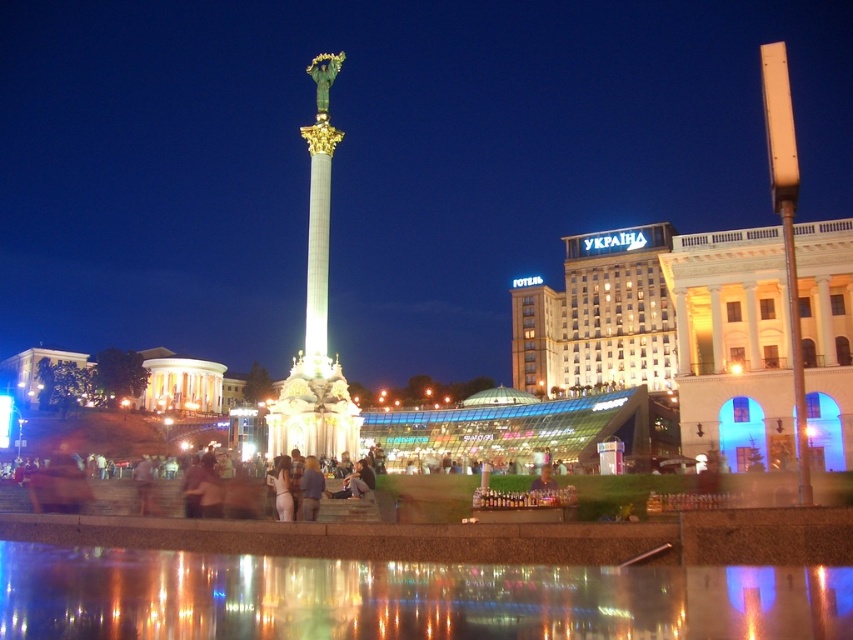
Question: Among these points, which one is nearest to the camera?

Choices:
 (A) (544, 476)
 (B) (318, 212)
 (C) (816, 572)

Answer: (C)

Question: Is transparent glass water at lower center smaller than smooth skin face at center?

Choices:
 (A) yes
 (B) no

Answer: (B)

Question: Can you confirm if shiny gold column at center is thinner than blue denim jeans at center?

Choices:
 (A) yes
 (B) no

Answer: (B)

Question: Is transparent glass water at lower center below blue denim jeans at center?

Choices:
 (A) yes
 (B) no

Answer: (A)

Question: Considering the real-world distances, which object is closest to the shiny gold column at center?

Choices:
 (A) transparent glass water at lower center
 (B) blue denim jeans at center
 (C) smooth skin face at center

Answer: (B)

Question: Which object appears farthest from the camera in this image?

Choices:
 (A) transparent glass water at lower center
 (B) smooth skin face at center
 (C) blue denim jeans at center

Answer: (B)